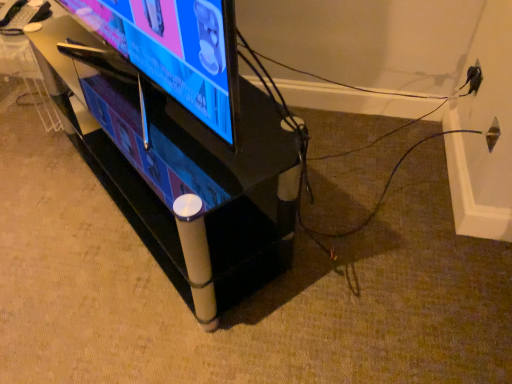
What is the approximate height of black glossy tv stand at center?

black glossy tv stand at center is 57.17 centimeters in height.

What do you see at coordinates (180, 169) in the screenshot?
I see `black glossy tv stand at center` at bounding box center [180, 169].

The width and height of the screenshot is (512, 384). What are the coordinates of `black glossy tv stand at center` in the screenshot? It's located at (180, 169).

The image size is (512, 384). Identify the location of matte black tv at center. (176, 50).

What do you see at coordinates (176, 50) in the screenshot? The height and width of the screenshot is (384, 512). I see `matte black tv at center` at bounding box center [176, 50].

Where is `black glossy tv stand at center`? This screenshot has width=512, height=384. black glossy tv stand at center is located at coordinates (180, 169).

Is black glossy tv stand at center to the left of matte black tv at center from the viewer's perspective?

No, black glossy tv stand at center is not to the left of matte black tv at center.

Which object is closer to the camera taking this photo, black glossy tv stand at center or matte black tv at center?

matte black tv at center.

Considering the positions of points (109, 189) and (173, 51), is point (109, 189) farther from camera compared to point (173, 51)?

Yes, it is behind point (173, 51).

From the image's perspective, is black glossy tv stand at center beneath matte black tv at center?

Correct, black glossy tv stand at center appears lower than matte black tv at center in the image.

From a real-world perspective, relative to matte black tv at center, is black glossy tv stand at center vertically above or below?

black glossy tv stand at center is below matte black tv at center.

Which object is wider, black glossy tv stand at center or matte black tv at center?

black glossy tv stand at center is wider.

Who is taller, black glossy tv stand at center or matte black tv at center?

black glossy tv stand at center is taller.

Who is smaller, black glossy tv stand at center or matte black tv at center?

With smaller size is matte black tv at center.

Is black glossy tv stand at center not within matte black tv at center?

→ Yes, black glossy tv stand at center is outside of matte black tv at center.

Is black glossy tv stand at center not near matte black tv at center?

That's not correct — black glossy tv stand at center is a little close to matte black tv at center.

Is black glossy tv stand at center turned away from matte black tv at center?

No, black glossy tv stand at center's orientation is not away from matte black tv at center.

What's the angular difference between black glossy tv stand at center and matte black tv at center's facing directions?

There is a 0.833-degree angle between the facing directions of black glossy tv stand at center and matte black tv at center.

How much distance is there between black glossy tv stand at center and matte black tv at center?

black glossy tv stand at center is 20.89 centimeters away from matte black tv at center.

The height and width of the screenshot is (384, 512). What are the coordinates of `furniture below the matte black tv at center (from the image's perspective)` in the screenshot? It's located at (180, 169).

Which is more to the left, matte black tv at center or black glossy tv stand at center?

matte black tv at center.

Is the position of matte black tv at center less distant than that of black glossy tv stand at center?

Yes, matte black tv at center is closer to the viewer.

Is point (199, 24) farther from camera compared to point (138, 111)?

No, it is not.

From the image's perspective, would you say matte black tv at center is shown under black glossy tv stand at center?

No, from the image's perspective, matte black tv at center is not below black glossy tv stand at center.

From a real-world perspective, which is physically below, matte black tv at center or black glossy tv stand at center?

black glossy tv stand at center, from a real-world perspective.

Considering the sizes of matte black tv at center and black glossy tv stand at center in the image, is matte black tv at center wider or thinner than black glossy tv stand at center?

In the image, matte black tv at center appears to be more narrow than black glossy tv stand at center.

Considering the relative sizes of matte black tv at center and black glossy tv stand at center in the image provided, is matte black tv at center taller than black glossy tv stand at center?

No.

Considering the relative sizes of matte black tv at center and black glossy tv stand at center in the image provided, is matte black tv at center bigger than black glossy tv stand at center?

Incorrect, matte black tv at center is not larger than black glossy tv stand at center.

Which is correct: matte black tv at center is inside black glossy tv stand at center, or outside of it?

The correct answer is: outside.

Does matte black tv at center touch black glossy tv stand at center?

matte black tv at center is not next to black glossy tv stand at center, and they're not touching.

Is matte black tv at center facing towards black glossy tv stand at center?

No.

At what (x,y) coordinates should I click in order to perform the action: click on television that is in front of the black glossy tv stand at center. Please return your answer as a coordinate pair (x, y). The height and width of the screenshot is (384, 512). Looking at the image, I should click on (176, 50).

Image resolution: width=512 pixels, height=384 pixels. Find the location of `television lying above the black glossy tv stand at center (from the image's perspective)`. television lying above the black glossy tv stand at center (from the image's perspective) is located at coordinates (176, 50).

You are a GUI agent. You are given a task and a screenshot of the screen. Output one action in this format:
    pyautogui.click(x=<x>, y=<y>)
    Task: Click on the television that is in front of the black glossy tv stand at center
    This screenshot has height=384, width=512.
    Given the screenshot: What is the action you would take?
    click(176, 50)